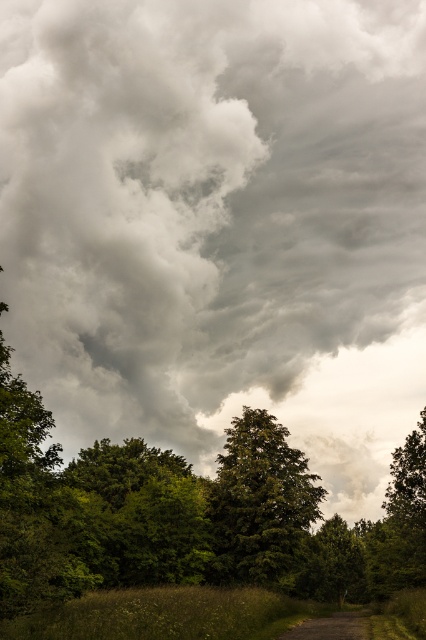
You are standing in the middle of the forest looking at the dramatic sky. There are two points marked in the image. The first point is at coordinates point (25, 3) and the second is at point (365, 536). Which point is closer to you?

Point (25, 3) is further to the viewer than point (365, 536). Therefore, the point closer to you is point (365, 536).